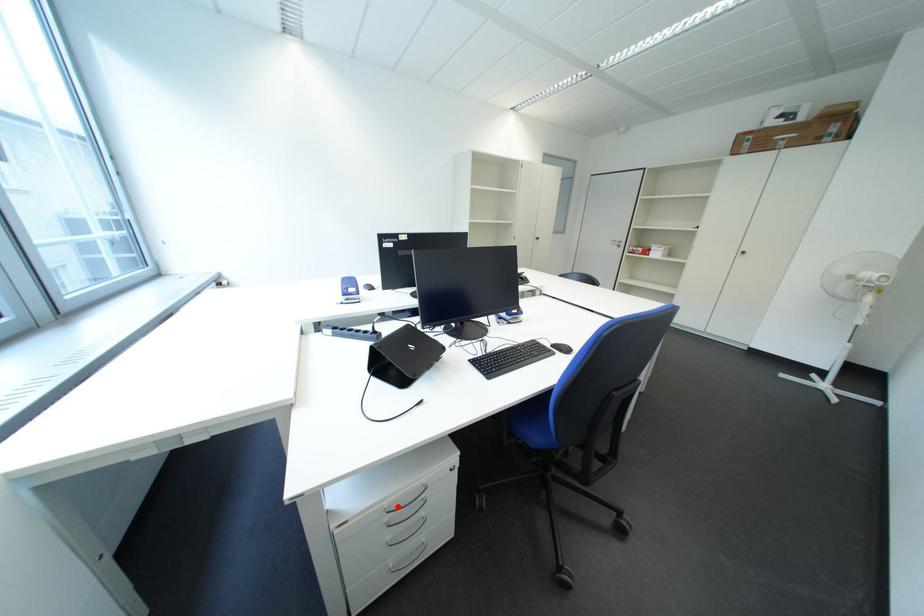
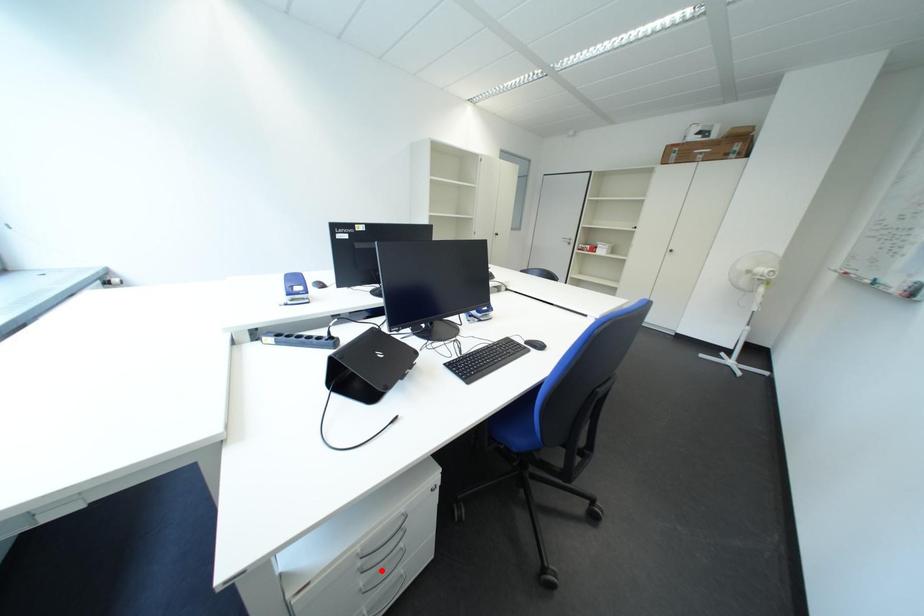
I am providing you with two images of the same scene from different viewpoints. A red point is marked on the first image and another point is marked on the second image. Are the points marked in image1 and image2 representing the same 3D position?

No